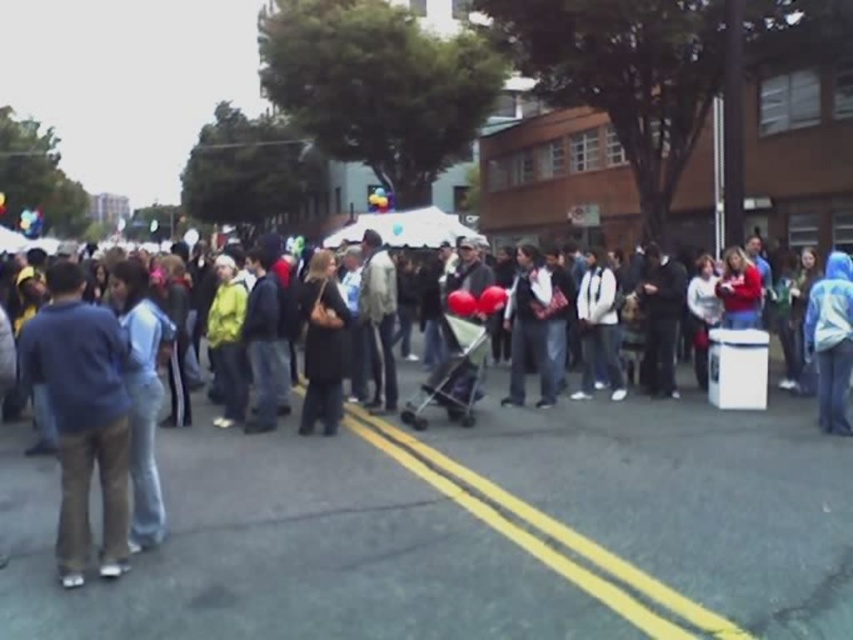
You are a photographer trying to capture a candid shot of the crowd at the event. You notice two people wearing a dark blue jacket at center and a dark gray coat at center. Which one is standing to the right of the other?

The dark blue jacket at center is positioned on the right side of the dark gray coat at center, so the dark blue jacket at center is to the right of the dark gray coat at center.

You are a photographer trying to capture a group photo of the crowd in the scene. You notice two people wearing a dark blue jacket at center and a dark gray coat at center. Since you want to ensure both are visible in the frame, which clothing item should you position closer to the camera to avoid being cropped out?

The dark blue jacket at center is wider than the dark gray coat at center, so positioning the dark blue jacket at center closer to the camera would ensure it fits within the frame without being cropped out.

You are a photographer trying to capture a photo of the crowd at the event. You notice two people wearing a dark blue jacket at center and a dark gray coat at center. Which of these two individuals is shorter?

The dark blue jacket at center is shorter than the dark gray coat at center, so the person wearing the dark blue jacket at center is shorter.